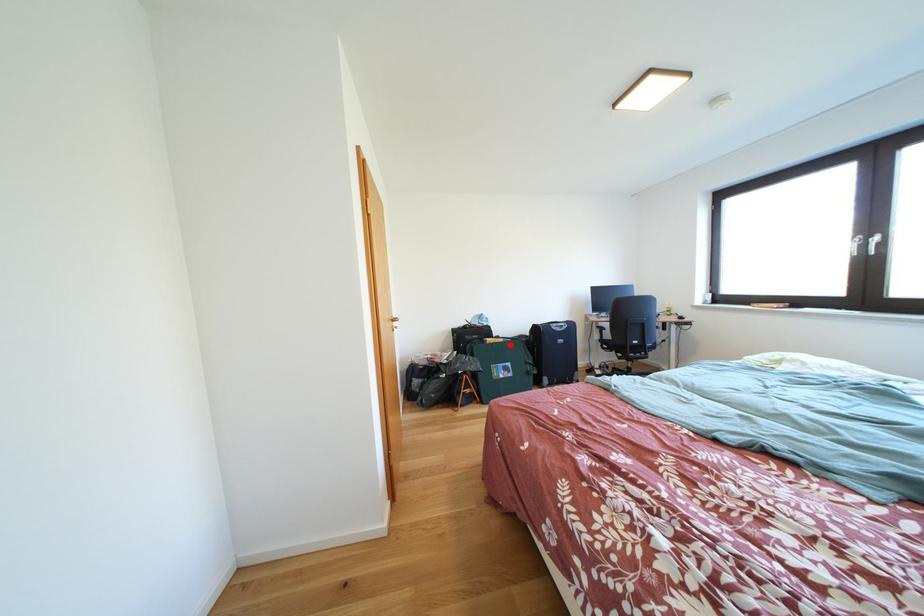
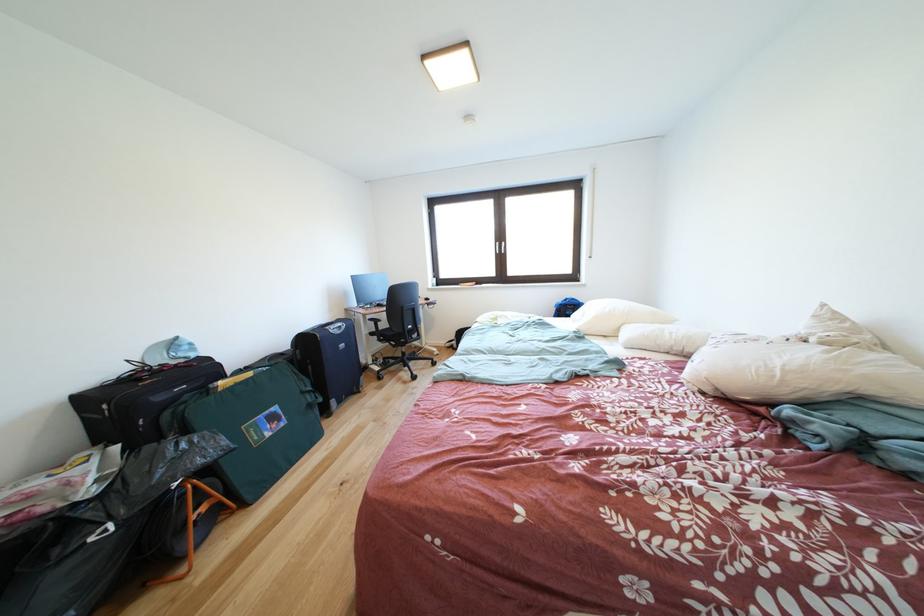
The point at the highlighted location is marked in the first image. Where is the corresponding point in the second image?

(259, 379)